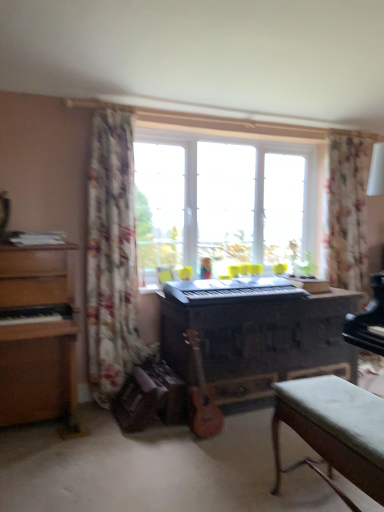
This screenshot has width=384, height=512. I want to click on free spot in front of wooden piano at center, so click(215, 462).